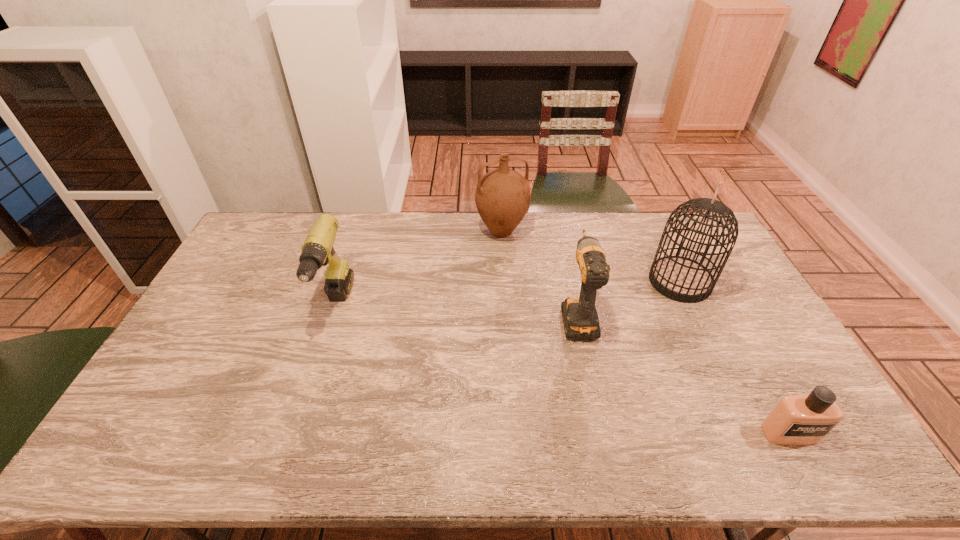
The image size is (960, 540). I want to click on free location at the left edge, so click(160, 416).

The width and height of the screenshot is (960, 540). Identify the location of vacant area at the right edge. (776, 403).

In order to click on vacant space at the near left corner of the desktop in this screenshot , I will do `click(160, 437)`.

Where is `empty location between the left drill and the nearest object`? This screenshot has width=960, height=540. empty location between the left drill and the nearest object is located at coordinates (563, 370).

This screenshot has height=540, width=960. In order to click on free space that is in between the perfume and the tallest object in this screenshot , I will do `click(734, 357)`.

Find the location of `free space between the leftmost object and the birdcage`. free space between the leftmost object and the birdcage is located at coordinates (508, 294).

Locate an element on the screen. The height and width of the screenshot is (540, 960). vacant area between the farthest object and the perfume is located at coordinates (645, 333).

Find the location of a particular element. The height and width of the screenshot is (540, 960). free space between the shortest object and the left drill is located at coordinates (563, 370).

I want to click on free space between the nearest object and the leftmost object, so click(x=563, y=370).

I want to click on free space between the tallest object and the perfume, so (734, 357).